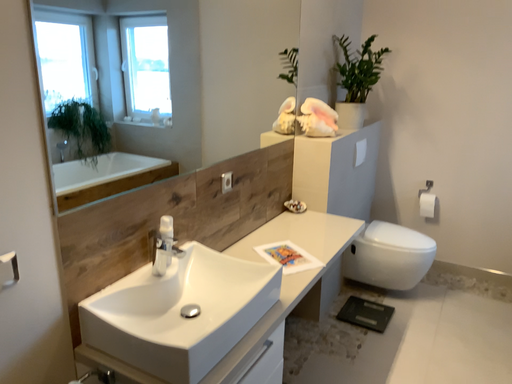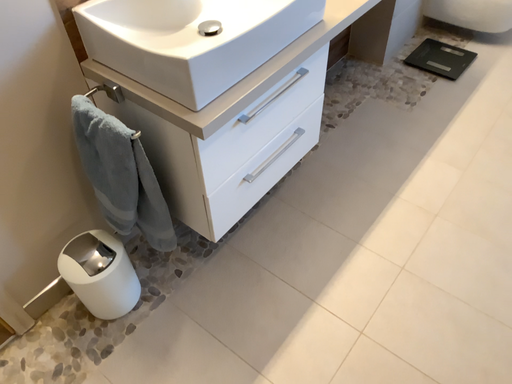
Question: Which way did the camera rotate in the video?

Choices:
 (A) rotated upward
 (B) rotated downward

Answer: (B)